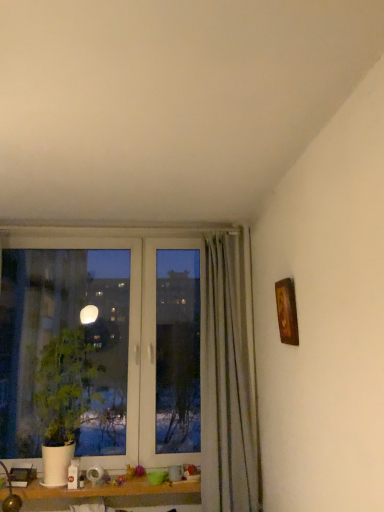
Locate an element on the screen. white matte pot at left is located at coordinates [64, 399].

Describe the element at coordinates (64, 399) in the screenshot. The height and width of the screenshot is (512, 384). I see `white matte pot at left` at that location.

This screenshot has width=384, height=512. What do you see at coordinates (287, 311) in the screenshot? I see `wooden frame at upper right` at bounding box center [287, 311].

Identify the location of wooden frame at upper right. (287, 311).

What is the approximate width of wooden frame at upper right?

The width of wooden frame at upper right is 6.52 centimeters.

Identify the location of white matte pot at left. (64, 399).

Does white matte pot at left appear on the right side of wooden frame at upper right?

In fact, white matte pot at left is to the left of wooden frame at upper right.

In the scene shown: Who is more distant, white matte pot at left or wooden frame at upper right?

Positioned behind is white matte pot at left.

Does point (42, 422) lie behind point (280, 297)?

Yes, point (42, 422) is behind point (280, 297).

From the image's perspective, is white matte pot at left on top of wooden frame at upper right?

No, from the image's perspective, white matte pot at left is not over wooden frame at upper right.

From a real-world perspective, which is physically above, white matte pot at left or wooden frame at upper right?

wooden frame at upper right is physically above.

In the scene shown: Which of these two, white matte pot at left or wooden frame at upper right, is thinner?

Thinner between the two is wooden frame at upper right.

Is white matte pot at left shorter than wooden frame at upper right?

No.

Between white matte pot at left and wooden frame at upper right, which one has smaller size?

wooden frame at upper right is smaller.

Is white matte pot at left inside the boundaries of wooden frame at upper right, or outside?

white matte pot at left cannot be found inside wooden frame at upper right.

Looking at this image, would you consider white matte pot at left to be distant from wooden frame at upper right?

white matte pot at left is positioned a significant distance from wooden frame at upper right.

Is white matte pot at left oriented towards wooden frame at upper right?

No, white matte pot at left is not turned towards wooden frame at upper right.

Can you tell me how much white matte pot at left and wooden frame at upper right differ in facing direction?

white matte pot at left and wooden frame at upper right are facing 90.1 degrees away from each other.

The height and width of the screenshot is (512, 384). Identify the location of picture frame lying above the white matte pot at left (from the image's perspective). click(287, 311).

Considering the relative positions of wooden frame at upper right and white matte pot at left in the image provided, is wooden frame at upper right to the left or to the right of white matte pot at left?

Based on their positions, wooden frame at upper right is located to the right of white matte pot at left.

Is wooden frame at upper right further to camera compared to white matte pot at left?

No, wooden frame at upper right is closer to the viewer.

Considering the positions of point (284, 334) and point (79, 411), is point (284, 334) closer or farther from the camera than point (79, 411)?

Point (284, 334).

From the image's perspective, would you say wooden frame at upper right is shown under white matte pot at left?

No, from the image's perspective, wooden frame at upper right is not below white matte pot at left.

From a real-world perspective, who is located higher, wooden frame at upper right or white matte pot at left?

wooden frame at upper right is physically above.

Which of these two, wooden frame at upper right or white matte pot at left, is wider?

Wider between the two is white matte pot at left.

Between wooden frame at upper right and white matte pot at left, which one has less height?

With less height is wooden frame at upper right.

Can you confirm if wooden frame at upper right is smaller than white matte pot at left?

Yes.

In the scene shown: Choose the correct answer: Is wooden frame at upper right inside white matte pot at left or outside it?

The correct answer is: outside.

Are wooden frame at upper right and white matte pot at left far apart?

wooden frame at upper right is positioned a significant distance from white matte pot at left.

Is wooden frame at upper right aimed at white matte pot at left?

No, wooden frame at upper right is not oriented towards white matte pot at left.

In the scene shown: How many degrees apart are the facing directions of wooden frame at upper right and white matte pot at left?

There is a 90.1-degree angle between the facing directions of wooden frame at upper right and white matte pot at left.

Find the location of a particular element. The image size is (384, 512). picture frame lying on the right of white matte pot at left is located at coordinates (287, 311).

Image resolution: width=384 pixels, height=512 pixels. Find the location of `picture frame that appears on the right of white matte pot at left`. picture frame that appears on the right of white matte pot at left is located at coordinates (287, 311).

Find the location of `houseplant below the wooden frame at upper right (from the image's perspective)`. houseplant below the wooden frame at upper right (from the image's perspective) is located at coordinates 64,399.